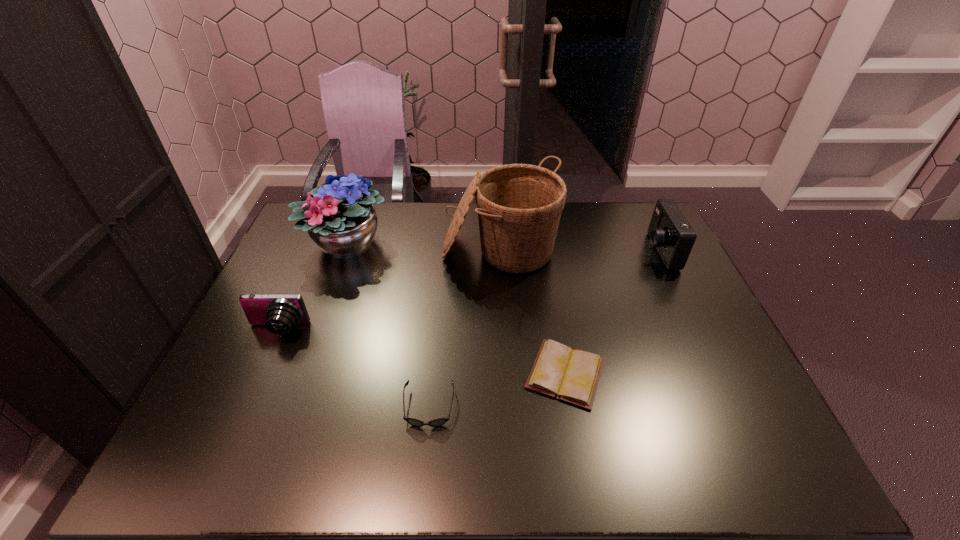
At what (x,y) coordinates should I click in order to perform the action: click on basket. Please return your answer as a coordinate pair (x, y). The image size is (960, 540). Looking at the image, I should click on pos(519,206).

At what (x,y) coordinates should I click in order to perform the action: click on bouquet. Please return your answer as a coordinate pair (x, y). Looking at the image, I should click on (339, 221).

Image resolution: width=960 pixels, height=540 pixels. I want to click on the farther camera, so click(669, 231).

Locate an element on the screen. This screenshot has height=540, width=960. the rightmost object is located at coordinates (669, 231).

Locate an element on the screen. This screenshot has height=540, width=960. the shorter camera is located at coordinates (279, 313).

Identify the location of the nearer camera. (279, 313).

Find the location of a particular element. sunglasses is located at coordinates (437, 422).

The image size is (960, 540). I want to click on the shortest object, so click(571, 375).

Identify the location of vacant area situated 0.070m on the front of the basket. This screenshot has height=540, width=960. [x=503, y=305].

Where is `free space located on the right of the bouquet`? This screenshot has height=540, width=960. free space located on the right of the bouquet is located at coordinates (424, 244).